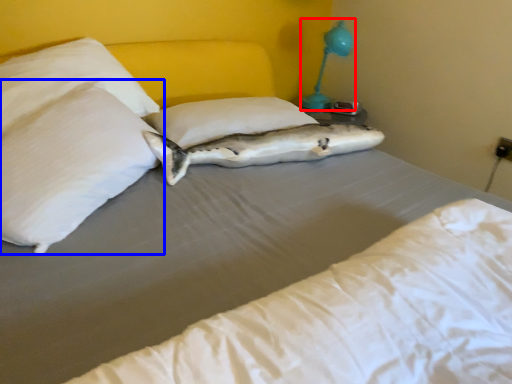
Question: Which of the following is the closest to the observer, bedside lamp (highlighted by a red box) or pillow (highlighted by a blue box)?

Choices:
 (A) bedside lamp
 (B) pillow

Answer: (B)